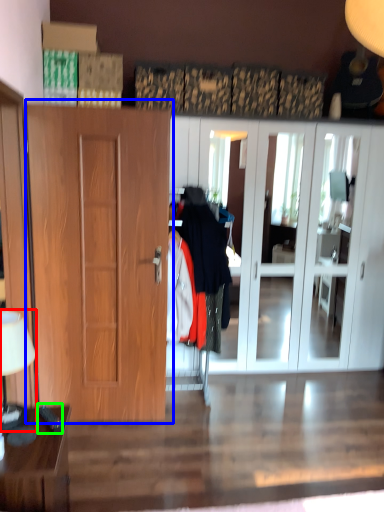
Question: Which object is positioned farthest from lamp (highlighted by a red box)? Select from door (highlighted by a blue box) and remote control (highlighted by a green box).

Choices:
 (A) door
 (B) remote control

Answer: (A)